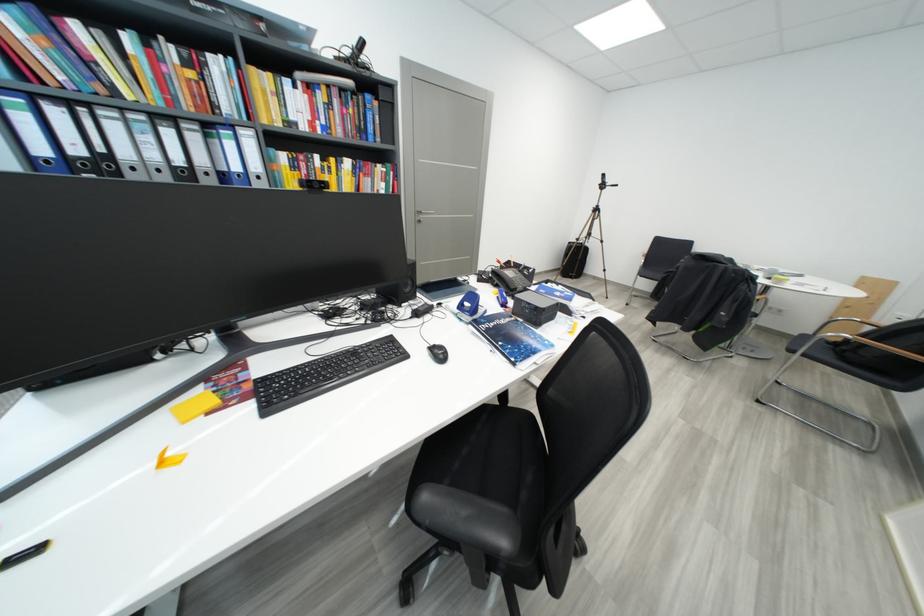
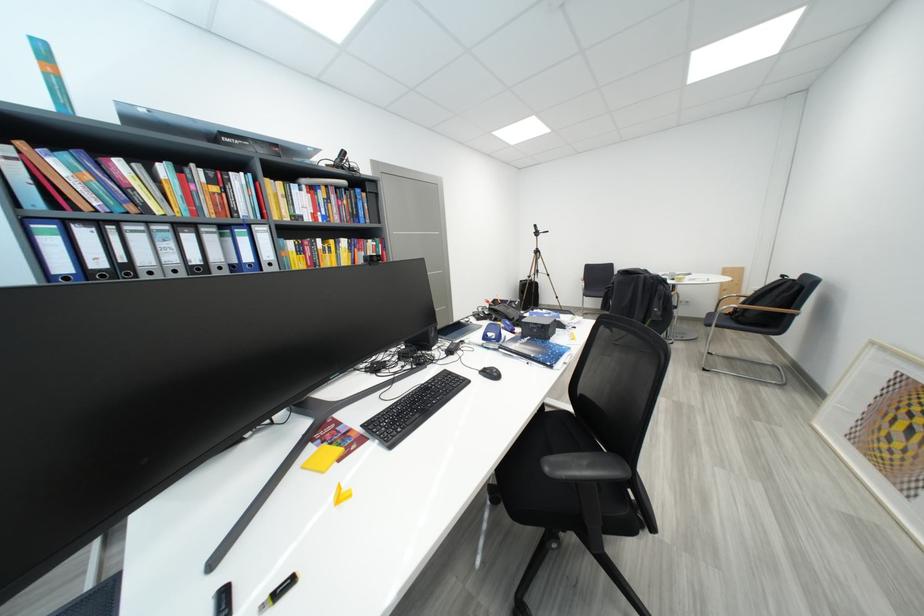
The point at (407, 350) is marked in the first image. Where is the corresponding point in the second image?

(467, 379)